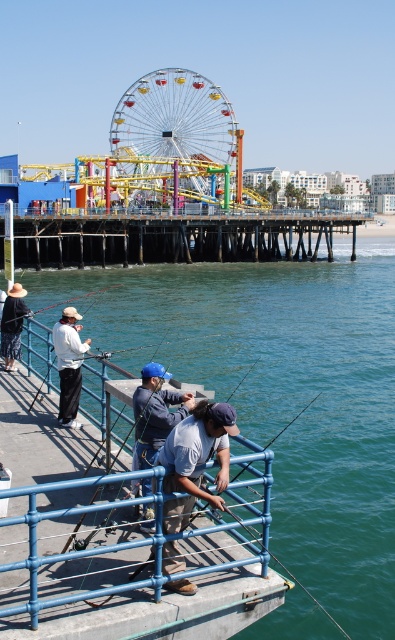
Who is shorter, wooden at center or white matte shirt at center?

With less height is white matte shirt at center.

Is point (238, 241) positioned behind point (65, 340)?

Yes, point (238, 241) is farther from viewer.

This screenshot has width=395, height=640. Find the location of `wooden at center`. wooden at center is located at coordinates (174, 237).

Is green water at lower center bigger than light blue denim shirt at center?

Yes.

Is green water at lower center further to the viewer compared to light blue denim shirt at center?

Yes, green water at lower center is further from the viewer.

Where is `green water at lower center`? The image size is (395, 640). green water at lower center is located at coordinates (280, 396).

Does multicolored metallic ferris wheel at center have a lesser height compared to blue denim shirt at center?

Incorrect, multicolored metallic ferris wheel at center's height does not fall short of blue denim shirt at center's.

Is multicolored metallic ferris wheel at center further to the viewer compared to blue denim shirt at center?

Yes, multicolored metallic ferris wheel at center is behind blue denim shirt at center.

Where is `multicolored metallic ferris wheel at center`? multicolored metallic ferris wheel at center is located at coordinates (174, 118).

Locate an element on the screen. multicolored metallic ferris wheel at center is located at coordinates (174, 118).